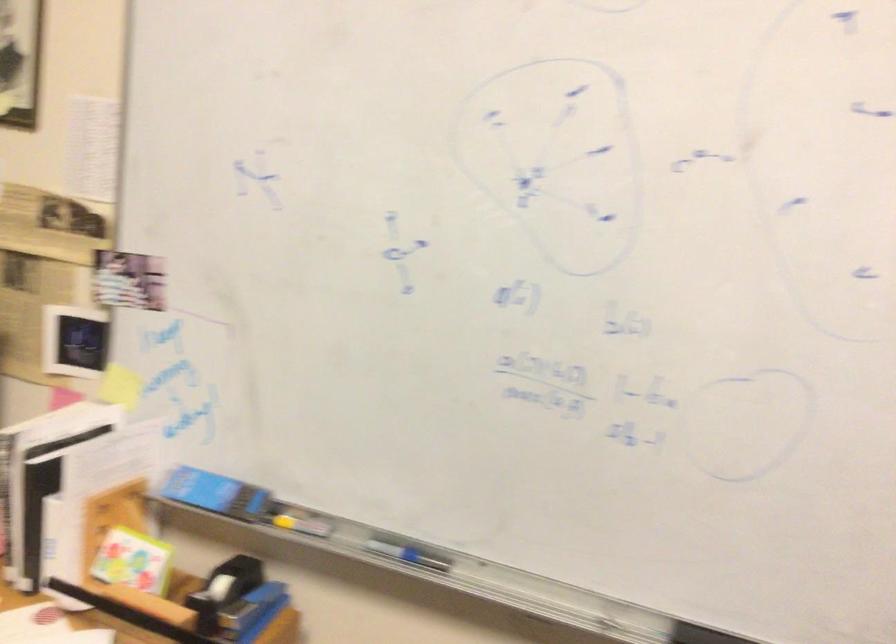
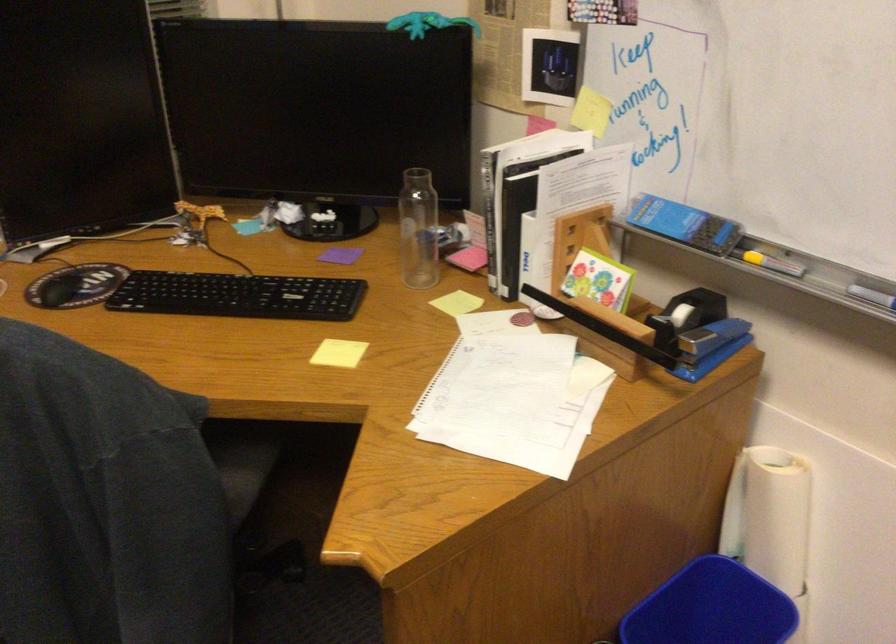
Where in the second image is the point corresponding to (300,529) from the first image?

(769, 261)